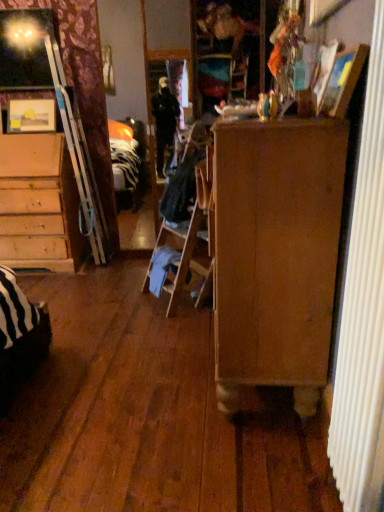
This screenshot has height=512, width=384. I want to click on wooden chest of drawers at right, so click(276, 254).

Measure the distance between point (214, 262) and camera.

Point (214, 262) is 1.71 meters from camera.

Image resolution: width=384 pixels, height=512 pixels. What do you see at coordinates (276, 254) in the screenshot?
I see `wooden chest of drawers at right` at bounding box center [276, 254].

Where is `wooden chest of drawers at right`? The width and height of the screenshot is (384, 512). wooden chest of drawers at right is located at coordinates (276, 254).